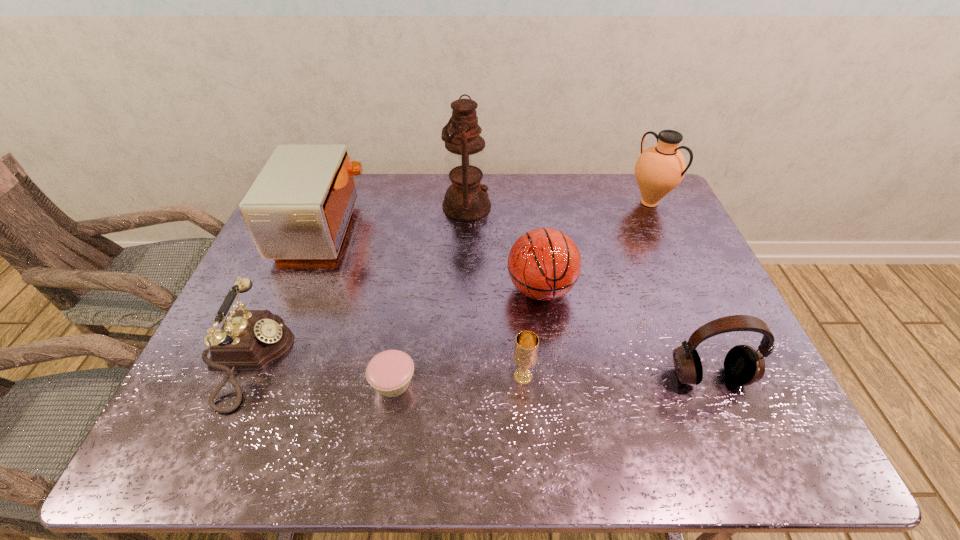
Where is `the fifth closest object to the toaster oven`? The height and width of the screenshot is (540, 960). the fifth closest object to the toaster oven is located at coordinates (525, 355).

This screenshot has height=540, width=960. Identify the location of vacant space that satisfies the following two spatial constraints: 1. on the back side of the chalice; 2. on the door side of the toaster oven. pyautogui.click(x=512, y=228).